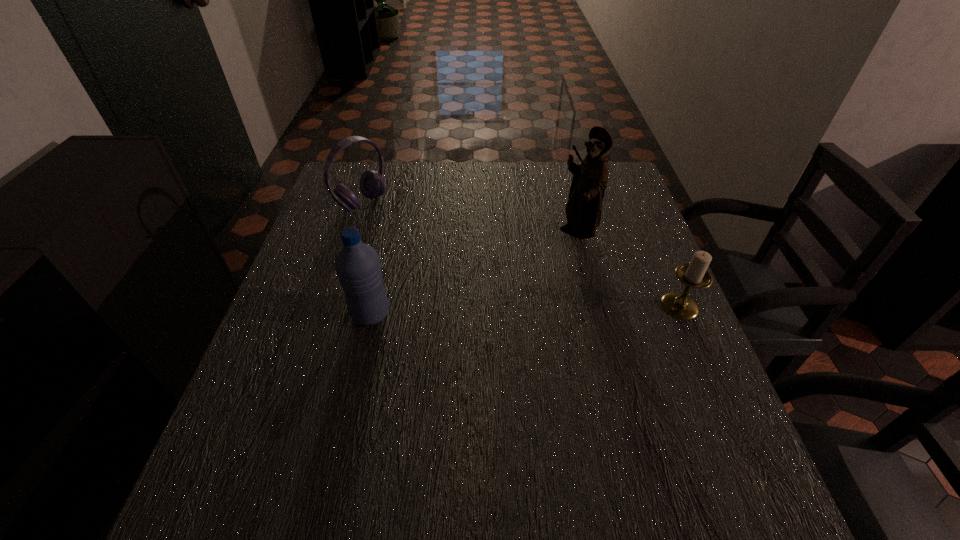
Find the location of a particular element. vacant space that's between the shortest object and the second shortest object is located at coordinates (521, 254).

Where is `empty location between the shortest object and the tallest object`? This screenshot has height=540, width=960. empty location between the shortest object and the tallest object is located at coordinates click(x=628, y=269).

At what (x,y) coordinates should I click in order to perform the action: click on vacant space in between the second object from right to left and the shortest object. Please return your answer as a coordinate pair (x, y). The image size is (960, 540). Looking at the image, I should click on (628, 269).

This screenshot has width=960, height=540. What are the coordinates of `free spot between the tallest object and the headset` in the screenshot? It's located at (469, 218).

Locate an element on the screen. unoccupied position between the tallest object and the second tallest object is located at coordinates (473, 274).

Identify the location of object that is the third closest one to the tallest object. (372, 183).

Locate which object ranks second in proximity to the third shortest object. Please provide its 2D coordinates. Your answer should be formatted as a tuple, i.e. [(x, y)], where the tuple contains the x and y coordinates of a point satisfying the conditions above.

[(583, 210)]

This screenshot has width=960, height=540. What are the coordinates of `vacant area in the image that satisfies the following two spatial constraints: 1. on the front side of the rightmost object; 2. on the left side of the second shortest object` in the screenshot? It's located at (329, 306).